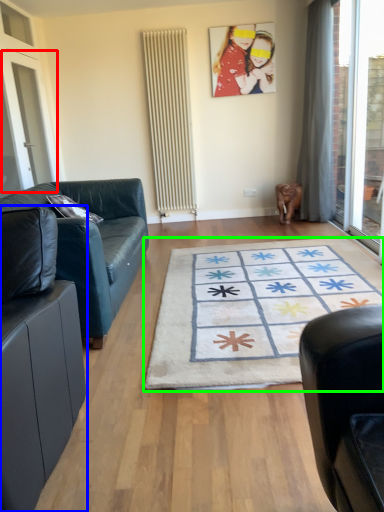
Question: Considering the real-world distances, which object is closest to screen door (highlighted by a red box)? studio couch (highlighted by a blue box) or mat (highlighted by a green box).

Choices:
 (A) studio couch
 (B) mat

Answer: (B)